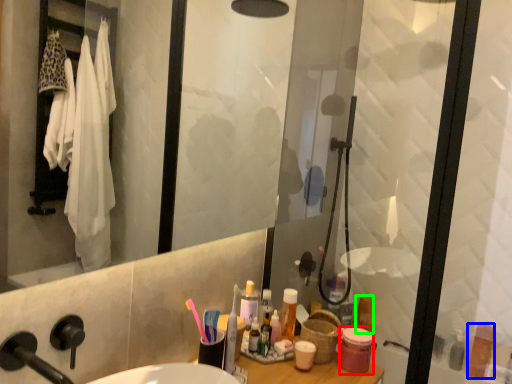
Question: Estimate the real-world distances between objects in this image. Which object is closer to toiletry (highlighted by a red box), toiletry (highlighted by a blue box) or toiletry (highlighted by a green box)?

Choices:
 (A) toiletry
 (B) toiletry

Answer: (B)